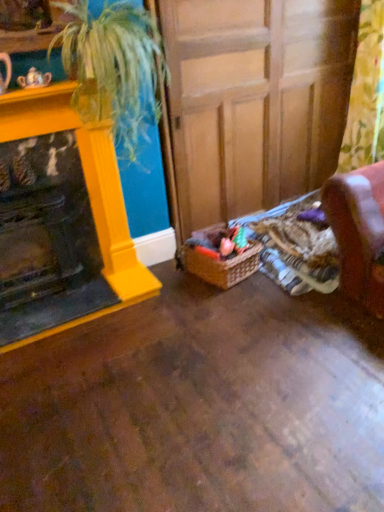
Question: Does woven brown basket at lower center have a greater width compared to floral fabric curtain at right?

Choices:
 (A) no
 (B) yes

Answer: (B)

Question: Is woven brown basket at lower center further to camera compared to floral fabric curtain at right?

Choices:
 (A) no
 (B) yes

Answer: (B)

Question: Is woven brown basket at lower center surrounding floral fabric curtain at right?

Choices:
 (A) yes
 (B) no

Answer: (B)

Question: Is woven brown basket at lower center not within floral fabric curtain at right?

Choices:
 (A) no
 (B) yes

Answer: (B)

Question: From the image's perspective, is woven brown basket at lower center located beneath floral fabric curtain at right?

Choices:
 (A) no
 (B) yes

Answer: (B)

Question: Is woven brown basket at lower center thinner than floral fabric curtain at right?

Choices:
 (A) no
 (B) yes

Answer: (A)

Question: Does matte yellow fireplace at left lie in front of woven brown basket at lower center?

Choices:
 (A) yes
 (B) no

Answer: (A)

Question: Is woven brown basket at lower center completely or partially inside matte yellow fireplace at left?

Choices:
 (A) yes
 (B) no

Answer: (B)

Question: Considering the relative positions of matte yellow fireplace at left and woven brown basket at lower center in the image provided, is matte yellow fireplace at left to the right of woven brown basket at lower center from the viewer's perspective?

Choices:
 (A) no
 (B) yes

Answer: (A)

Question: From the image's perspective, is matte yellow fireplace at left over woven brown basket at lower center?

Choices:
 (A) yes
 (B) no

Answer: (A)

Question: From a real-world perspective, is matte yellow fireplace at left on top of woven brown basket at lower center?

Choices:
 (A) yes
 (B) no

Answer: (A)

Question: From the image's perspective, does matte yellow fireplace at left appear lower than woven brown basket at lower center?

Choices:
 (A) no
 (B) yes

Answer: (A)

Question: Can you confirm if floral fabric curtain at right is bigger than green leafy plant at upper left?

Choices:
 (A) no
 (B) yes

Answer: (A)